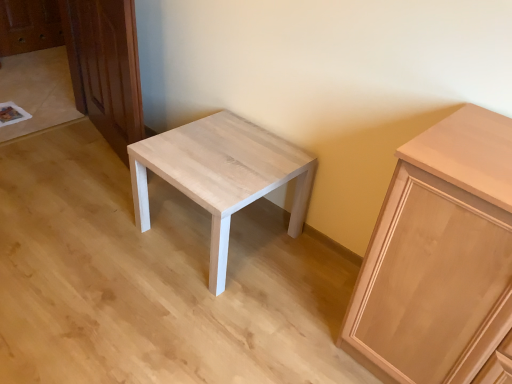
Question: From the image's perspective, does light wood/texture stool at center appear lower than light brown wood dresser at left?

Choices:
 (A) yes
 (B) no

Answer: (A)

Question: Does light wood/texture stool at center have a smaller size compared to light brown wood dresser at left?

Choices:
 (A) yes
 (B) no

Answer: (B)

Question: Would you say light wood/texture stool at center contains light brown wood dresser at left?

Choices:
 (A) yes
 (B) no

Answer: (B)

Question: Considering the relative sizes of light wood/texture stool at center and light brown wood dresser at left in the image provided, is light wood/texture stool at center bigger than light brown wood dresser at left?

Choices:
 (A) yes
 (B) no

Answer: (A)

Question: Considering the relative positions of light wood/texture stool at center and light brown wood dresser at left in the image provided, is light wood/texture stool at center to the left of light brown wood dresser at left from the viewer's perspective?

Choices:
 (A) no
 (B) yes

Answer: (A)

Question: In terms of size, does light brown wood dresser at left appear bigger or smaller than light wood/texture stool at center?

Choices:
 (A) big
 (B) small

Answer: (B)

Question: Looking at their shapes, would you say light brown wood dresser at left is wider or thinner than light wood/texture stool at center?

Choices:
 (A) thin
 (B) wide

Answer: (A)

Question: From the image's perspective, is light brown wood dresser at left located above or below light wood/texture stool at center?

Choices:
 (A) below
 (B) above

Answer: (B)

Question: Is light brown wood dresser at left spatially inside light wood/texture stool at center, or outside of it?

Choices:
 (A) inside
 (B) outside

Answer: (B)

Question: From the image's perspective, is light brown wood cabinet at right positioned above or below light wood/texture stool at center?

Choices:
 (A) above
 (B) below

Answer: (B)

Question: From a real-world perspective, is light brown wood cabinet at right above or below light wood/texture stool at center?

Choices:
 (A) above
 (B) below

Answer: (A)

Question: Is light brown wood cabinet at right spatially inside light wood/texture stool at center, or outside of it?

Choices:
 (A) outside
 (B) inside

Answer: (A)

Question: Relative to light wood/texture stool at center, is light brown wood cabinet at right in front or behind?

Choices:
 (A) front
 (B) behind

Answer: (A)

Question: From a real-world perspective, is light brown wood cabinet at right physically located above or below light brown wood dresser at left?

Choices:
 (A) above
 (B) below

Answer: (B)

Question: Looking at their shapes, would you say light brown wood cabinet at right is wider or thinner than light brown wood dresser at left?

Choices:
 (A) thin
 (B) wide

Answer: (B)